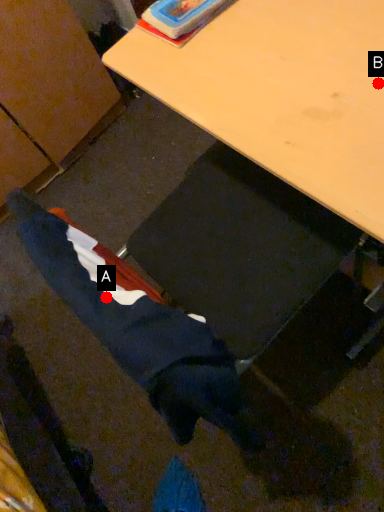
Question: Two points are circled on the image, labeled by A and B beside each circle. Among these points, which one is nearest to the camera?

Choices:
 (A) A is closer
 (B) B is closer

Answer: (B)